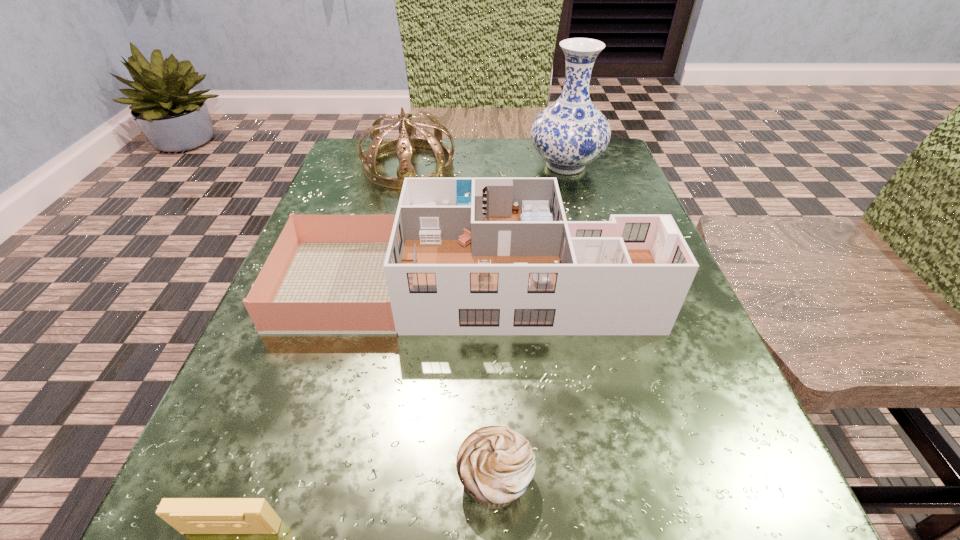
This screenshot has width=960, height=540. Find the location of `vase`. vase is located at coordinates (570, 133).

Identify the location of tiara. Image resolution: width=960 pixels, height=540 pixels. tap(407, 139).

Locate an element on the screen. The width and height of the screenshot is (960, 540). dollhouse is located at coordinates (466, 256).

The height and width of the screenshot is (540, 960). In order to click on muffin in this screenshot , I will do `click(496, 465)`.

Where is `videotape`? This screenshot has height=540, width=960. videotape is located at coordinates (187, 515).

What are the coordinates of `vacant region located on the left of the vase` in the screenshot? It's located at tap(496, 166).

Locate an element on the screen. This screenshot has height=540, width=960. blank area located 0.200m on the front of the tiara is located at coordinates (388, 254).

The image size is (960, 540). I want to click on free space located 0.080m on the left of the fourth farthest object, so click(384, 478).

This screenshot has width=960, height=540. I want to click on vase located in the far edge section of the desktop, so click(x=570, y=133).

The image size is (960, 540). Find the location of `tiara at the far edge`. tiara at the far edge is located at coordinates pyautogui.click(x=407, y=139).